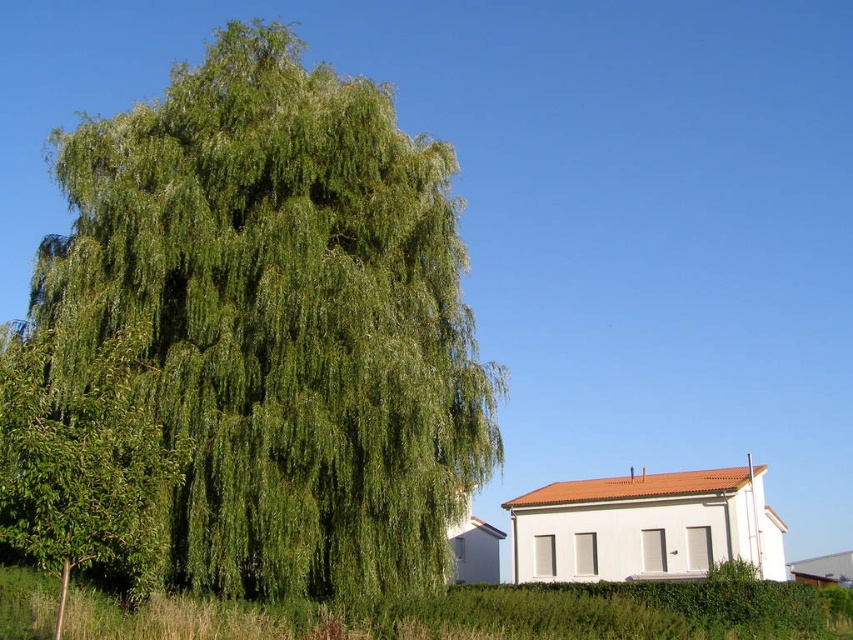
Is green leafy willow at left below green leafy tree at left?

Actually, green leafy willow at left is above green leafy tree at left.

At what (x,y) coordinates should I click in order to perform the action: click on green leafy willow at left. Please return your answer as a coordinate pair (x, y). Looking at the image, I should click on (280, 317).

What are the coordinates of `green leafy willow at left` in the screenshot? It's located at (280, 317).

Locate an element on the screen. The width and height of the screenshot is (853, 640). green leafy willow at left is located at coordinates (280, 317).